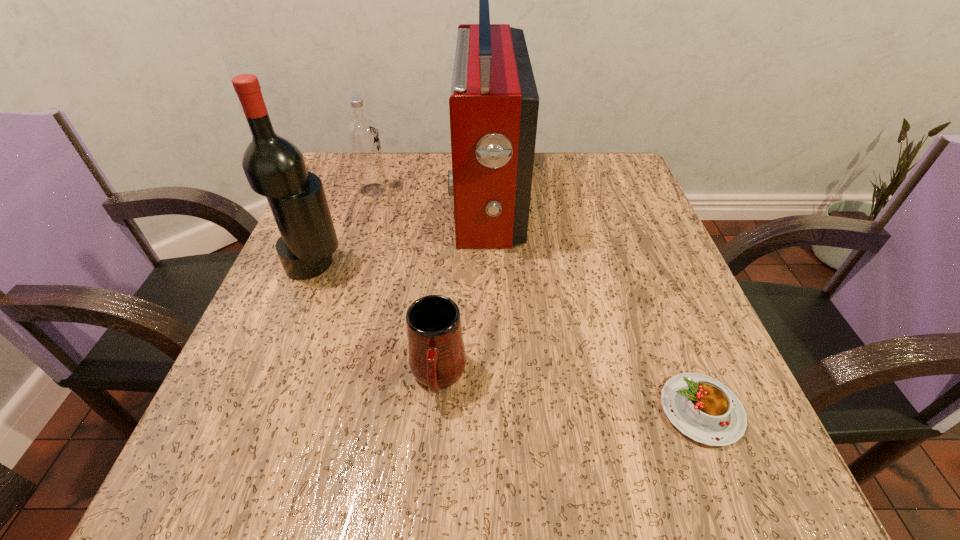
The width and height of the screenshot is (960, 540). I want to click on vacant area that satisfies the following two spatial constraints: 1. on the front-facing side of the rightmost object; 2. on the right side of the radio receiver, so click(x=492, y=410).

The width and height of the screenshot is (960, 540). I want to click on free space that satisfies the following two spatial constraints: 1. on the front label of the third shortest object; 2. on the left side of the rightmost object, so click(x=304, y=410).

Find the location of a particular element. Image resolution: width=960 pixels, height=540 pixels. vacant region that satisfies the following two spatial constraints: 1. on the side of the mug with the handle; 2. on the left side of the shortest object is located at coordinates [x=435, y=410].

Where is `free space that satisfies the following two spatial constraints: 1. on the front label of the third tallest object; 2. on the left side of the pudding`? Image resolution: width=960 pixels, height=540 pixels. free space that satisfies the following two spatial constraints: 1. on the front label of the third tallest object; 2. on the left side of the pudding is located at coordinates (304, 410).